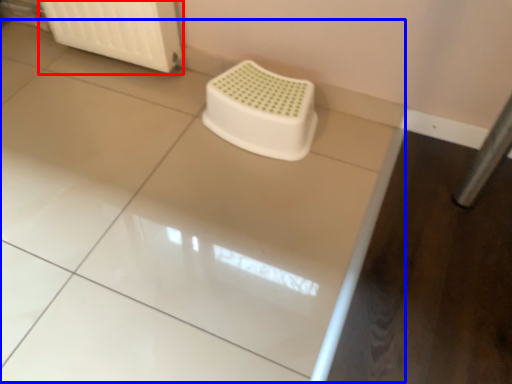
Question: Which of the following is the farthest to the observer, radiator (highlighted by a red box) or counter top (highlighted by a blue box)?

Choices:
 (A) radiator
 (B) counter top

Answer: (A)